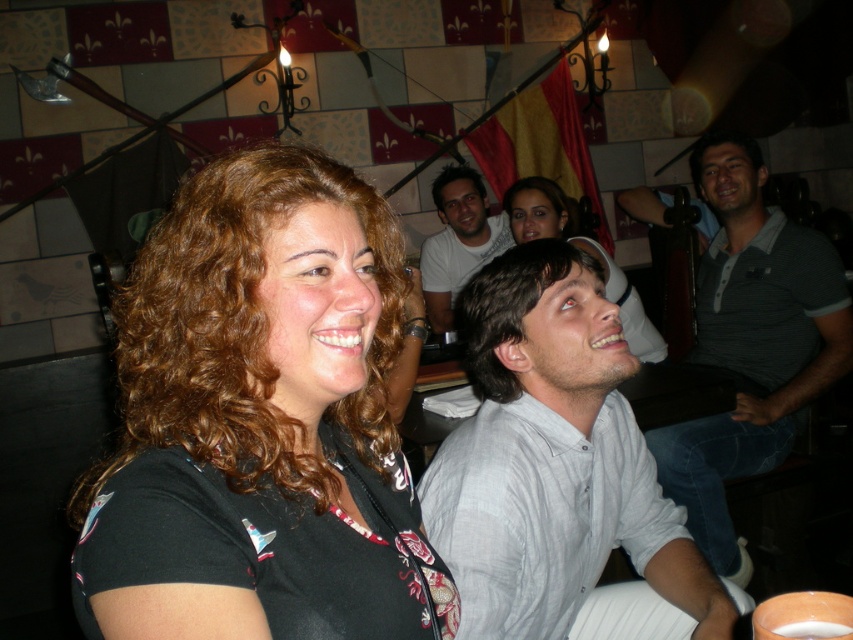
Who is more forward, (534, 243) or (473, 173)?

Positioned in front is point (534, 243).

Which is above, light gray cotton shirt at center or white shirt at center?

white shirt at center is higher up.

Is point (537, 440) closer to camera compared to point (427, 316)?

Yes, it is in front of point (427, 316).

I want to click on light gray cotton shirt at center, so click(x=554, y=461).

Looking at this image, who is taller, brown curly hair at center or dark brown curly hair at upper right?

dark brown curly hair at upper right is taller.

Does brown curly hair at center have a greater height compared to dark brown curly hair at upper right?

Incorrect, brown curly hair at center's height is not larger of dark brown curly hair at upper right's.

Where is `brown curly hair at center`? This screenshot has width=853, height=640. brown curly hair at center is located at coordinates (547, 198).

Identify the location of brown curly hair at center. The width and height of the screenshot is (853, 640). (547, 198).

Is white shirt at center further to the viewer compared to matte black shirt at center?

Yes.

Describe the element at coordinates (457, 241) in the screenshot. Image resolution: width=853 pixels, height=640 pixels. I see `white shirt at center` at that location.

This screenshot has width=853, height=640. Find the location of `white shirt at center`. white shirt at center is located at coordinates (457, 241).